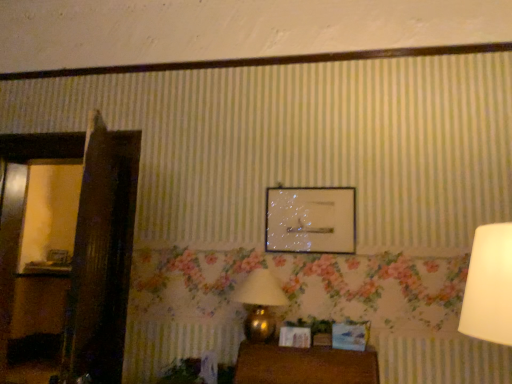
Find the location of a particular element. This screenshot has width=512, height=384. clear glass picture frame at center, placed as the first picture frame when sorted from front to back is located at coordinates (311, 220).

Describe the element at coordinates (311, 220) in the screenshot. I see `clear glass picture frame at center, the first picture frame viewed from the right` at that location.

The image size is (512, 384). In order to click on clear glass picture frame at center, placed as the first picture frame when sorted from front to back in this screenshot , I will do `click(311, 220)`.

Is gold metallic table lamp at lower center positioned before wooden table at lower center?

That is False.

Can you confirm if gold metallic table lamp at lower center is bigger than wooden table at lower center?

No.

Does point (272, 282) come in front of point (266, 355)?

That is False.

Can we say wooden table at lower center lies outside clear glass picture frame at center, the 2th picture frame positioned from the left?

Absolutely, wooden table at lower center is external to clear glass picture frame at center, the 2th picture frame positioned from the left.

From a real-world perspective, between wooden table at lower center and clear glass picture frame at center, positioned as the second picture frame in bottom-to-top order, who is vertically lower?

From a 3D spatial view, wooden table at lower center is below.

Is wooden table at lower center with clear glass picture frame at center, placed as the first picture frame when sorted from front to back?

No, wooden table at lower center is not making contact with clear glass picture frame at center, placed as the first picture frame when sorted from front to back.

Is gold metallic table lamp at lower center bigger than clear glass picture frame at center, the first picture frame viewed from the right?

Yes, gold metallic table lamp at lower center is bigger than clear glass picture frame at center, the first picture frame viewed from the right.

Considering the relative positions of gold metallic table lamp at lower center and clear glass picture frame at center, positioned as the second picture frame in bottom-to-top order, in the image provided, is gold metallic table lamp at lower center to the left of clear glass picture frame at center, positioned as the second picture frame in bottom-to-top order, from the viewer's perspective?

Yes.

From a real-world perspective, is gold metallic table lamp at lower center located higher than clear glass picture frame at center, placed as the first picture frame when sorted from front to back?

No.

From the image's perspective, is clear glass picture frame at center, the first picture frame viewed from the right, over wooden table at lower center?

Yes, from the image's perspective, clear glass picture frame at center, the first picture frame viewed from the right, is above wooden table at lower center.

Is clear glass picture frame at center, the first picture frame viewed from the right, in contact with wooden table at lower center?

clear glass picture frame at center, the first picture frame viewed from the right, is not next to wooden table at lower center, and they're not touching.

Considering the relative sizes of clear glass picture frame at center, the first picture frame when ordered from top to bottom, and wooden table at lower center in the image provided, is clear glass picture frame at center, the first picture frame when ordered from top to bottom, thinner than wooden table at lower center?

Correct, the width of clear glass picture frame at center, the first picture frame when ordered from top to bottom, is less than that of wooden table at lower center.

Between clear glass picture frame at center, the first picture frame viewed from the right, and wooden table at lower center, which one is positioned in front?

wooden table at lower center.

From a real-world perspective, is clear glass picture frame at center, the 2th picture frame positioned from the left, over gold metallic table lamp at lower center?

Indeed, from a real-world perspective, clear glass picture frame at center, the 2th picture frame positioned from the left, stands above gold metallic table lamp at lower center.

How much distance is there between clear glass picture frame at center, positioned as the second picture frame in bottom-to-top order, and gold metallic table lamp at lower center?

17.75 inches.

Which object is further away from the camera, clear glass picture frame at center, which is the second picture frame from back to front, or gold metallic table lamp at lower center?

clear glass picture frame at center, which is the second picture frame from back to front, is further away from the camera.

Which object is positioned more to the left, clear glass picture frame at center, positioned as the second picture frame in bottom-to-top order, or gold metallic table lamp at lower center?

gold metallic table lamp at lower center.

From a real-world perspective, starting from the gold metallic table lamp at lower center, which picture frame is the 1st one vertically above it? Please provide its 2D coordinates.

[(58, 257)]

What's the angular difference between gold metallic table lamp at lower center and wooden picture frame at left, acting as the 1th picture frame starting from the left,'s facing directions?

There is a 0.393-degree angle between the facing directions of gold metallic table lamp at lower center and wooden picture frame at left, acting as the 1th picture frame starting from the left.

Between gold metallic table lamp at lower center and wooden picture frame at left, which is the second picture frame from right to left, which one appears on the left side from the viewer's perspective?

wooden picture frame at left, which is the second picture frame from right to left, is more to the left.

Does gold metallic table lamp at lower center lie behind wooden picture frame at left, marked as the first picture frame in a back-to-front arrangement?

No, gold metallic table lamp at lower center is closer to the camera.

Are clear glass picture frame at center, the first picture frame viewed from the right, and wooden picture frame at left, which is counted as the 1th picture frame, starting from the bottom, located far from each other?

Yes, clear glass picture frame at center, the first picture frame viewed from the right, and wooden picture frame at left, which is counted as the 1th picture frame, starting from the bottom, are located far from each other.

Looking at this image, between clear glass picture frame at center, which is the second picture frame from back to front, and wooden picture frame at left, which appears as the 2th picture frame when viewed from the front, which one has smaller width?

clear glass picture frame at center, which is the second picture frame from back to front.

How much distance is there between clear glass picture frame at center, placed as the first picture frame when sorted from front to back, and wooden picture frame at left, which is the second picture frame from right to left?

clear glass picture frame at center, placed as the first picture frame when sorted from front to back, and wooden picture frame at left, which is the second picture frame from right to left, are 7.28 feet apart.

Is clear glass picture frame at center, which is the second picture frame from back to front, turned away from wooden picture frame at left, acting as the 1th picture frame starting from the left?

No, wooden picture frame at left, acting as the 1th picture frame starting from the left, is not at the back of clear glass picture frame at center, which is the second picture frame from back to front.

Where is `table lamp above the wooden table at lower center (from a real-world perspective)`? table lamp above the wooden table at lower center (from a real-world perspective) is located at coordinates (260, 304).

Image resolution: width=512 pixels, height=384 pixels. In order to click on furniture on the left of the clear glass picture frame at center, positioned as the second picture frame in bottom-to-top order in this screenshot , I will do `click(304, 365)`.

Which object lies nearer to the anchor point wooden table at lower center, wooden picture frame at left, which is counted as the 1th picture frame, starting from the bottom, or clear glass picture frame at center, which is the second picture frame from back to front?

clear glass picture frame at center, which is the second picture frame from back to front, lies closer to wooden table at lower center than the other object.

Considering their positions, is wooden table at lower center positioned closer to wooden picture frame at left, which is counted as the 1th picture frame, starting from the bottom, than gold metallic table lamp at lower center?

gold metallic table lamp at lower center is closer to wooden picture frame at left, which is counted as the 1th picture frame, starting from the bottom.

From the image, which object appears to be farther from wooden picture frame at left, which appears as the 2th picture frame when viewed from the front, gold metallic table lamp at lower center or wooden table at lower center?

Based on the image, wooden table at lower center appears to be further to wooden picture frame at left, which appears as the 2th picture frame when viewed from the front.

Based on their spatial positions, is wooden picture frame at left, marked as the second picture frame in a top-to-bottom arrangement, or wooden table at lower center closer to gold metallic table lamp at lower center?

The object closer to gold metallic table lamp at lower center is wooden table at lower center.

Based on their spatial positions, is wooden picture frame at left, which is counted as the 1th picture frame, starting from the bottom, or gold metallic table lamp at lower center further from clear glass picture frame at center, the first picture frame when ordered from top to bottom?

wooden picture frame at left, which is counted as the 1th picture frame, starting from the bottom, lies further to clear glass picture frame at center, the first picture frame when ordered from top to bottom, than the other object.

Which object lies further to the anchor point gold metallic table lamp at lower center, wooden table at lower center or clear glass picture frame at center, the first picture frame viewed from the right?

clear glass picture frame at center, the first picture frame viewed from the right, is further to gold metallic table lamp at lower center.

Based on their spatial positions, is gold metallic table lamp at lower center or wooden picture frame at left, which is the second picture frame from right to left, further from wooden table at lower center?

wooden picture frame at left, which is the second picture frame from right to left, lies further to wooden table at lower center than the other object.

Considering their positions, is wooden picture frame at left, which is counted as the 1th picture frame, starting from the bottom, positioned closer to wooden table at lower center than gold metallic table lamp at lower center?

gold metallic table lamp at lower center is closer to wooden table at lower center.

At what (x,y) coordinates should I click in order to perform the action: click on picture frame between gold metallic table lamp at lower center and wooden picture frame at left, acting as the 1th picture frame starting from the left, from front to back. Please return your answer as a coordinate pair (x, y). Looking at the image, I should click on click(x=311, y=220).

Where is `picture frame between wooden table at lower center and wooden picture frame at left, which is the second picture frame from right to left, from front to back`? picture frame between wooden table at lower center and wooden picture frame at left, which is the second picture frame from right to left, from front to back is located at coordinates (311, 220).

Locate an element on the screen. This screenshot has width=512, height=384. table lamp located between wooden table at lower center and wooden picture frame at left, which appears as the 2th picture frame when viewed from the front, in the depth direction is located at coordinates (260, 304).

The height and width of the screenshot is (384, 512). Find the location of `table lamp between clear glass picture frame at center, positioned as the second picture frame in bottom-to-top order, and wooden table at lower center in the up-down direction`. table lamp between clear glass picture frame at center, positioned as the second picture frame in bottom-to-top order, and wooden table at lower center in the up-down direction is located at coordinates (260, 304).